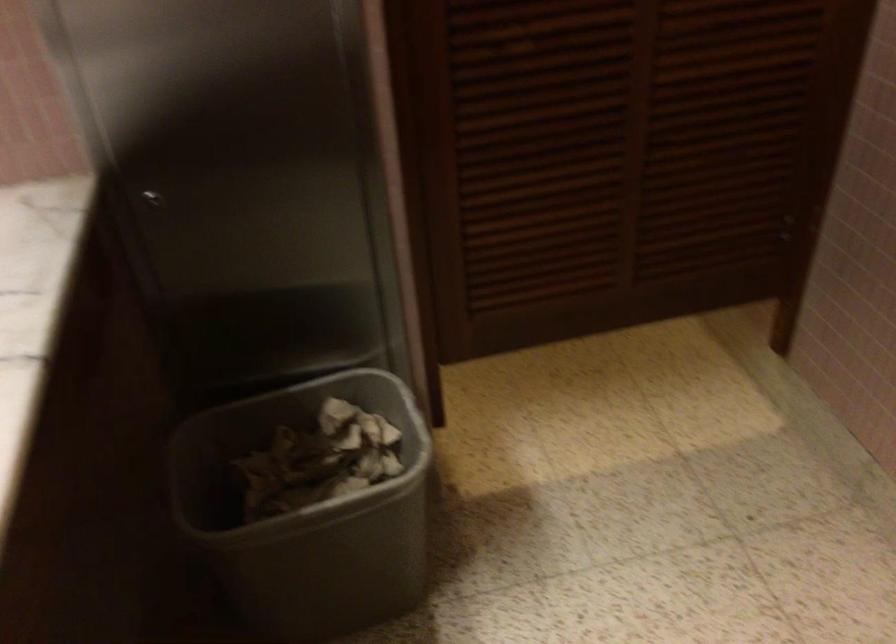
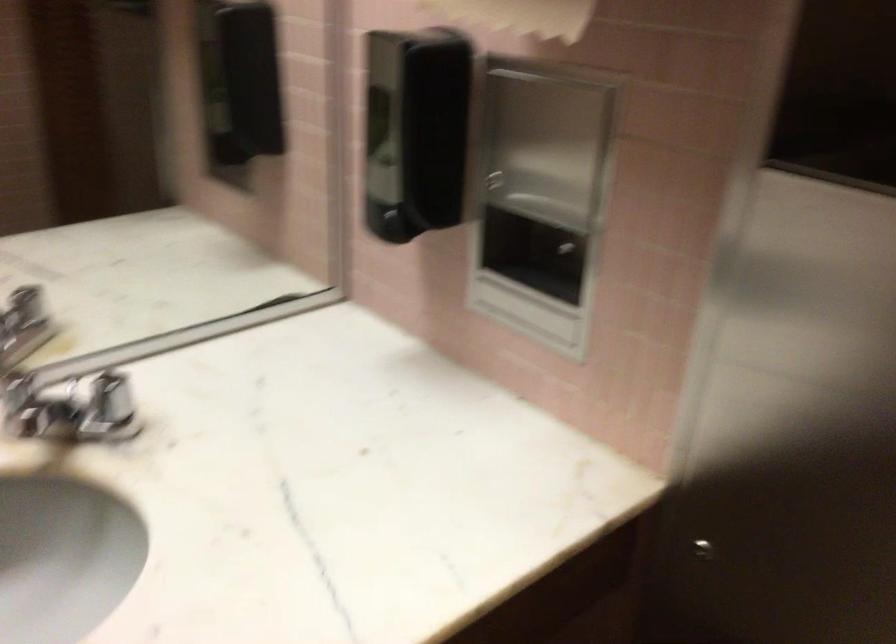
Question: Based on the continuous images, in which direction is the camera rotating? Reply with the corresponding letter.

Choices:
 (A) Left
 (B) Right
 (C) Up
 (D) Down

Answer: (A)